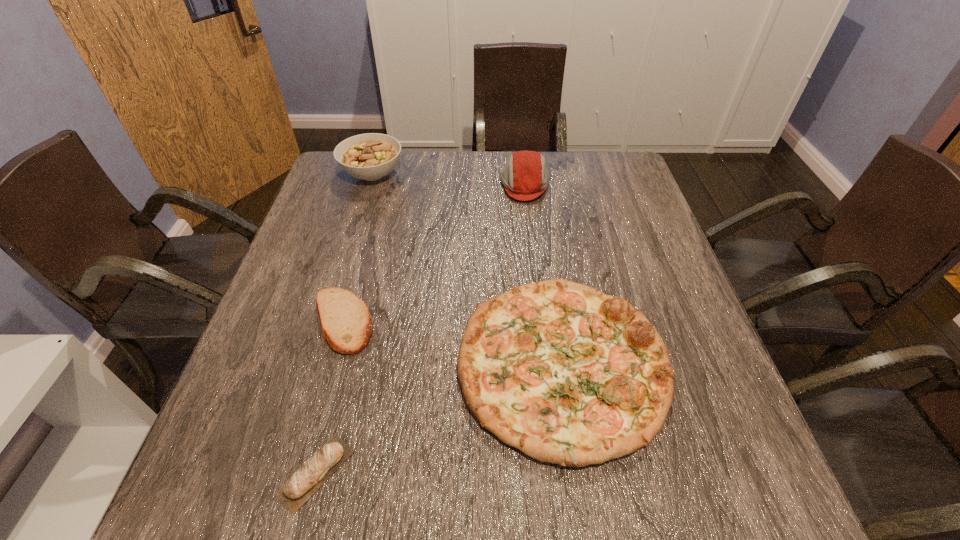
Locate an element on the screen. The width and height of the screenshot is (960, 540). free space that satisfies the following two spatial constraints: 1. on the front-facing side of the pizza; 2. on the right side of the cap is located at coordinates (546, 366).

Locate an element on the screen. vacant area that satisfies the following two spatial constraints: 1. on the back side of the pizza; 2. on the front-facing side of the cap is located at coordinates (536, 185).

At what (x,y) coordinates should I click in order to perform the action: click on free space that satisfies the following two spatial constraints: 1. on the front-facing side of the cap; 2. on the front side of the farther pita bread. Please return your answer as a coordinate pair (x, y). This screenshot has height=540, width=960. Looking at the image, I should click on (541, 321).

What are the coordinates of `free spot that satisfies the following two spatial constraints: 1. on the front-facing side of the cap; 2. on the left side of the pizza` in the screenshot? It's located at [x=546, y=366].